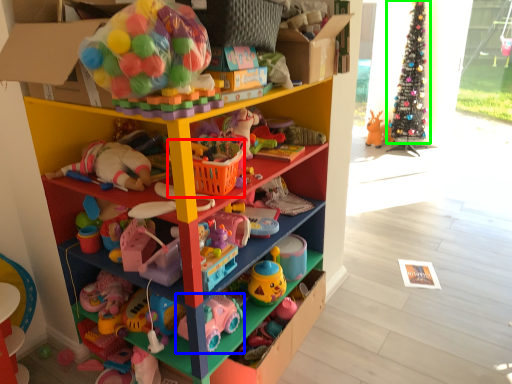
Question: Considering the real-world distances, which object is farthest from basket (highlighted by a red box)? toy (highlighted by a blue box) or christmas tree (highlighted by a green box)?

Choices:
 (A) toy
 (B) christmas tree

Answer: (B)